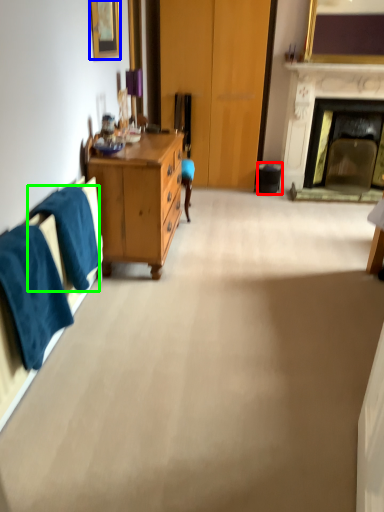
Question: Which is nearer to the trash bin/can (highlighted by a red box)? picture frame (highlighted by a blue box) or towel/napkin (highlighted by a green box).

Choices:
 (A) picture frame
 (B) towel/napkin

Answer: (A)